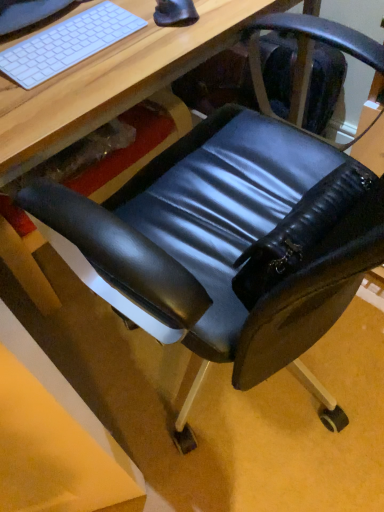
Identify the location of free spot in front of white matte keyboard at upper left. This screenshot has width=384, height=512. (66, 90).